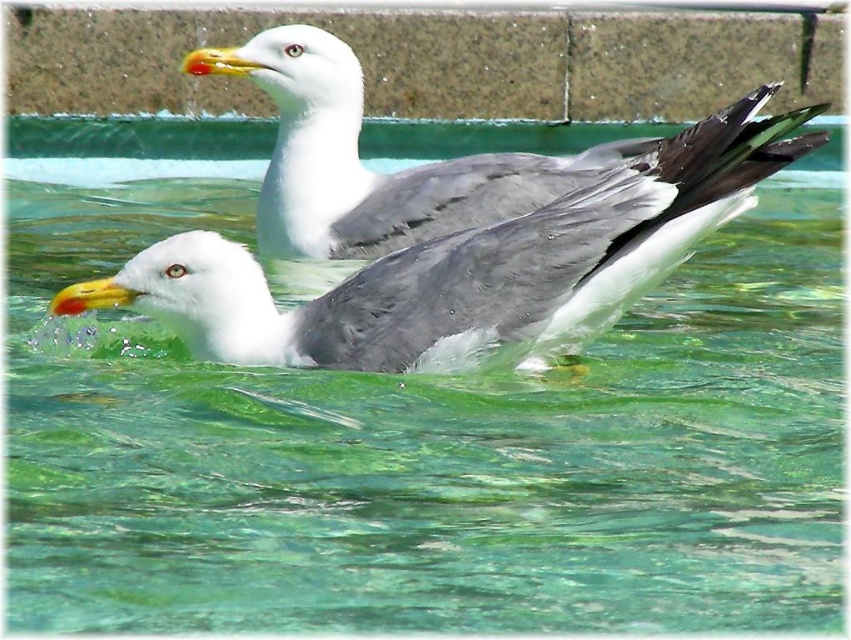
You are a photographer trying to capture a clear shot of the gray matte seagull at center and the white matte seagull at upper center. Which seagull will appear closer to the camera in the photo?

The gray matte seagull at center will appear closer to the camera because it is positioned in front of the white matte seagull at upper center.

You are a birdwatcher trying to identify seagulls in the water. You see the gray matte seagull at center and the white matte seagull at upper center. Which seagull has a smaller height?

The gray matte seagull at center is shorter than the white matte seagull at upper center, so the gray matte seagull at center has a smaller height.

You are a photographer trying to capture both the gray matte seagull at center and the white matte seagull at upper center in a single frame. Based on their sizes in the image, which seagull would you need to zoom in more on to ensure it takes up more of the photo?

The gray matte seagull at center occupies less space than the white matte seagull at upper center, so you would need to zoom in more on the gray matte seagull at center to make it larger in the photo.